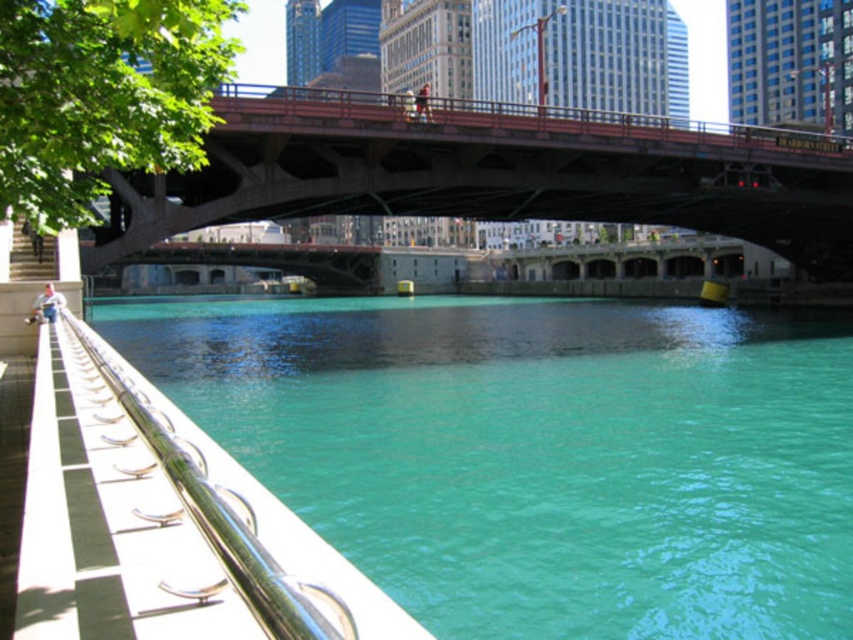
Between point (454, 468) and point (381, 144), which one is positioned in front?

Positioned in front is point (454, 468).

Between point (750, 404) and point (387, 145), which one is positioned behind?

The point (750, 404) is more distant.

Image resolution: width=853 pixels, height=640 pixels. I want to click on teal glossy water at center, so click(538, 452).